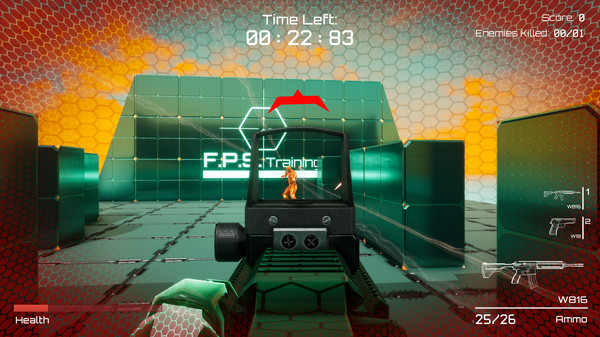
Where is `neon green bar`? The image size is (600, 337). neon green bar is located at coordinates (271, 172).